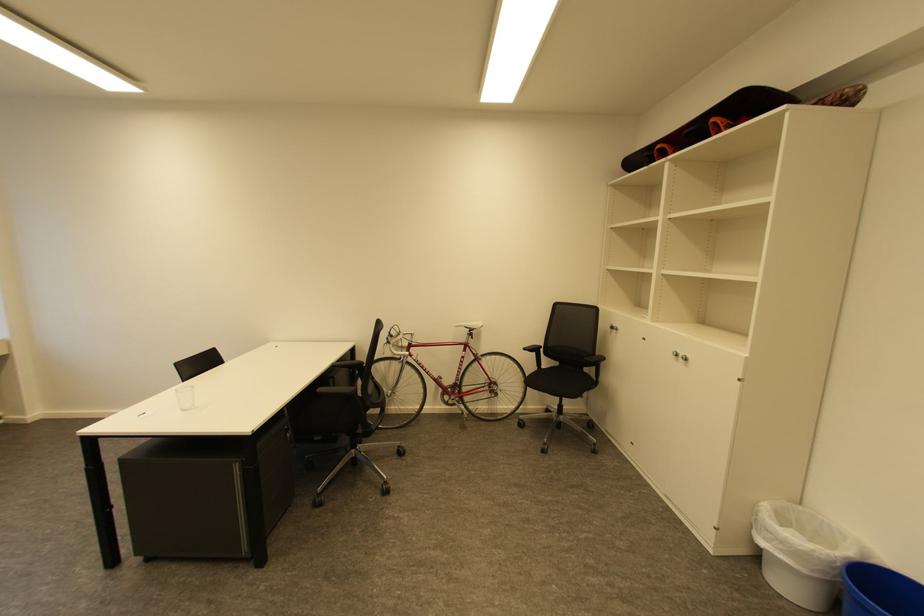
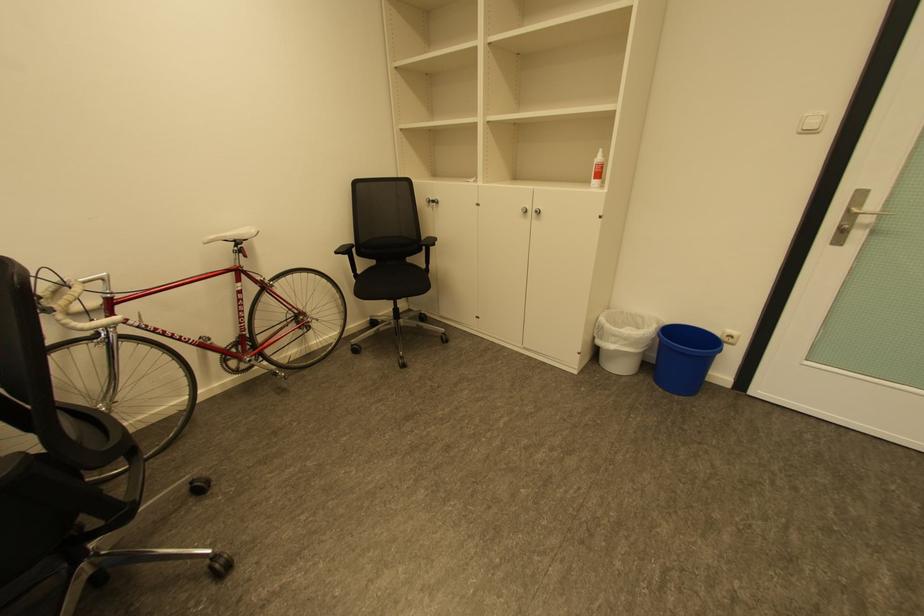
The point at (397, 351) is marked in the first image. Where is the corresponding point in the second image?

(70, 326)